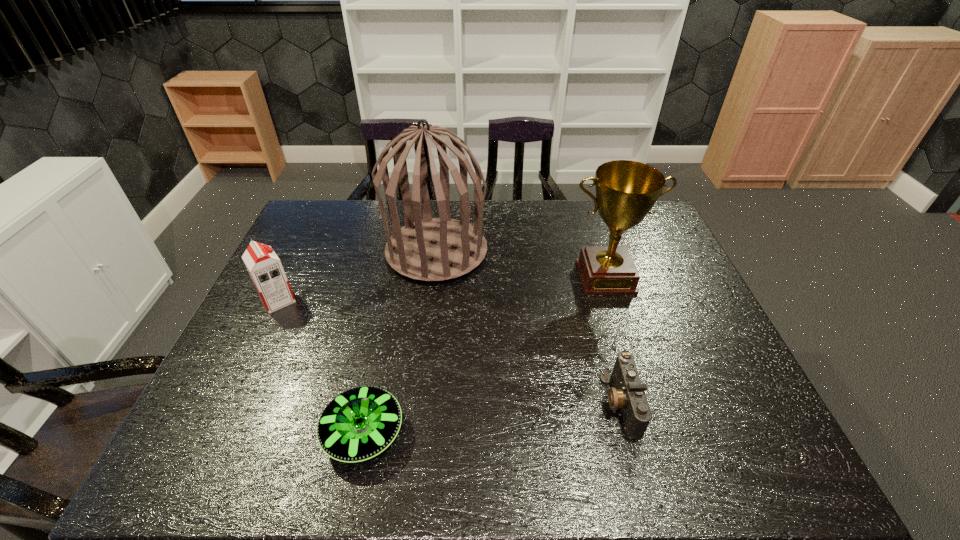
This screenshot has height=540, width=960. Find the location of `vacant position at the left edge of the desktop`. vacant position at the left edge of the desktop is located at coordinates (332, 241).

At what (x,y) coordinates should I click in order to perform the action: click on vacant space at the right edge. Please return your answer as a coordinate pair (x, y). Looking at the image, I should click on (684, 354).

What are the coordinates of `free location at the far left corner of the desktop` in the screenshot? It's located at (345, 218).

Find the location of a particular element. The width and height of the screenshot is (960, 540). vacant point located between the soya milk and the tallest object is located at coordinates (357, 275).

The width and height of the screenshot is (960, 540). Find the location of `vacant area that lies between the tallest object and the camera`. vacant area that lies between the tallest object and the camera is located at coordinates (529, 327).

This screenshot has height=540, width=960. I want to click on free space that is in between the award and the camera, so pos(613,340).

Identify the location of empty space that is in between the saucer and the camera. (492, 418).

Identify the location of free space between the saucer and the camera. This screenshot has height=540, width=960. (492, 418).

You are a GUI agent. You are given a task and a screenshot of the screen. Output one action in this format:
    pyautogui.click(x=<x>, y=<y>)
    Task: Click on the free space between the fourth shortest object and the soya milk
    Image resolution: width=960 pixels, height=540 pixels.
    Given the screenshot: What is the action you would take?
    pyautogui.click(x=442, y=288)

Locate an element on the screen. free space between the award and the saucer is located at coordinates (485, 355).